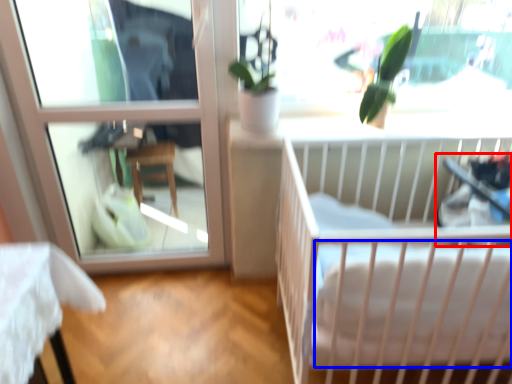
Question: Among these objects, which one is nearest to the camera, baby carriage (highlighted by a red box) or mattress (highlighted by a blue box)?

Choices:
 (A) baby carriage
 (B) mattress

Answer: (B)